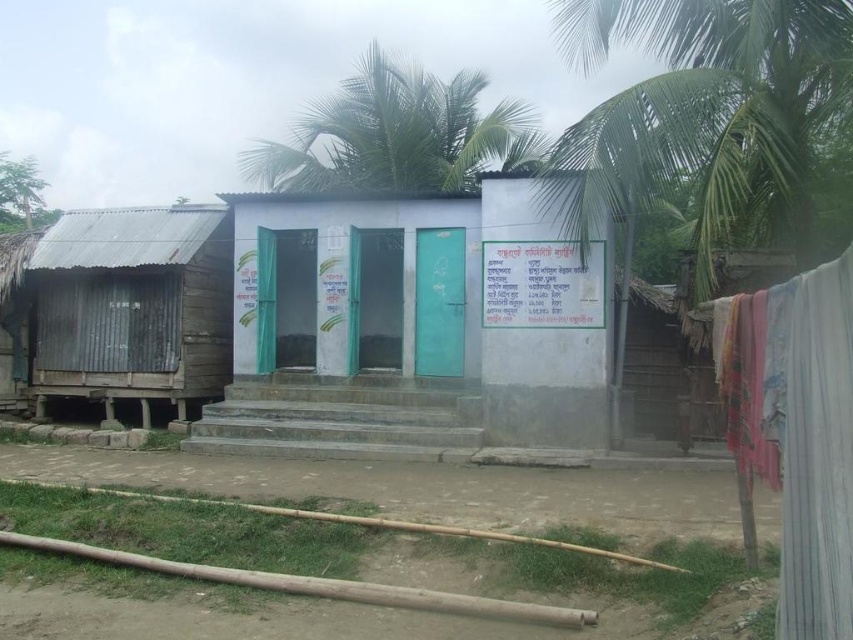
Question: Is green leafy palm tree at upper right to the right of white fabric at lower right from the viewer's perspective?

Choices:
 (A) no
 (B) yes

Answer: (B)

Question: Does white fabric at lower right appear under green leafy palm tree at upper center?

Choices:
 (A) no
 (B) yes

Answer: (B)

Question: Which is nearer to the green leafy palm tree at upper right?

Choices:
 (A) green leafy palm tree at upper center
 (B) rusty corrugated metal hut at left
 (C) white painted concrete toilet at center

Answer: (A)

Question: Does green leafy palm tree at upper right appear under white fabric at lower right?

Choices:
 (A) no
 (B) yes

Answer: (A)

Question: Which object is the closest to the green leafy palm tree at upper right?

Choices:
 (A) white painted concrete toilet at center
 (B) rusty corrugated metal hut at left
 (C) green leafy palm tree at upper center
 (D) white fabric at lower right

Answer: (C)

Question: Considering the real-world distances, which object is farthest from the white painted concrete toilet at center?

Choices:
 (A) green leafy palm tree at upper center
 (B) green leafy palm tree at upper right

Answer: (B)